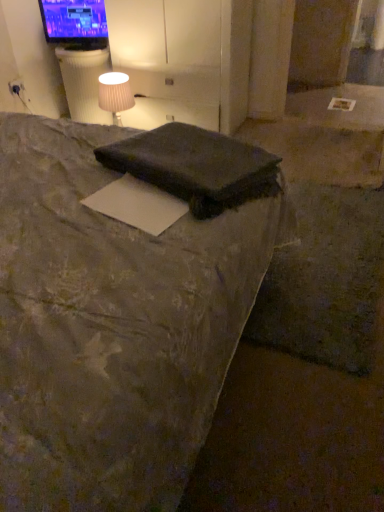
Question: Considering the relative sizes of matte white outlet at upper left and matte white fabric at upper left in the image provided, is matte white outlet at upper left wider than matte white fabric at upper left?

Choices:
 (A) yes
 (B) no

Answer: (B)

Question: Does matte white outlet at upper left have a larger size compared to matte white fabric at upper left?

Choices:
 (A) yes
 (B) no

Answer: (B)

Question: Are matte white outlet at upper left and matte white fabric at upper left located far from each other?

Choices:
 (A) no
 (B) yes

Answer: (A)

Question: From the image's perspective, would you say matte white outlet at upper left is positioned over matte white fabric at upper left?

Choices:
 (A) no
 (B) yes

Answer: (B)

Question: Does matte white outlet at upper left appear on the right side of matte white fabric at upper left?

Choices:
 (A) no
 (B) yes

Answer: (A)

Question: From the image's perspective, is matte white outlet at upper left located beneath matte white fabric at upper left?

Choices:
 (A) yes
 (B) no

Answer: (B)

Question: Is the surface of dark gray fabric bed at center in direct contact with matte black tv at upper left?

Choices:
 (A) yes
 (B) no

Answer: (B)

Question: Can matte black tv at upper left be found inside dark gray fabric bed at center?

Choices:
 (A) no
 (B) yes

Answer: (A)

Question: From a real-world perspective, is dark gray fabric bed at center on top of matte black tv at upper left?

Choices:
 (A) no
 (B) yes

Answer: (A)

Question: Is dark gray fabric bed at center far away from matte black tv at upper left?

Choices:
 (A) yes
 (B) no

Answer: (A)

Question: Could you tell me if dark gray fabric bed at center is facing matte black tv at upper left?

Choices:
 (A) no
 (B) yes

Answer: (B)

Question: Is dark gray fabric bed at center smaller than matte black tv at upper left?

Choices:
 (A) no
 (B) yes

Answer: (A)

Question: From the image's perspective, is white matte paper at center on matte white fabric at upper left?

Choices:
 (A) no
 (B) yes

Answer: (A)